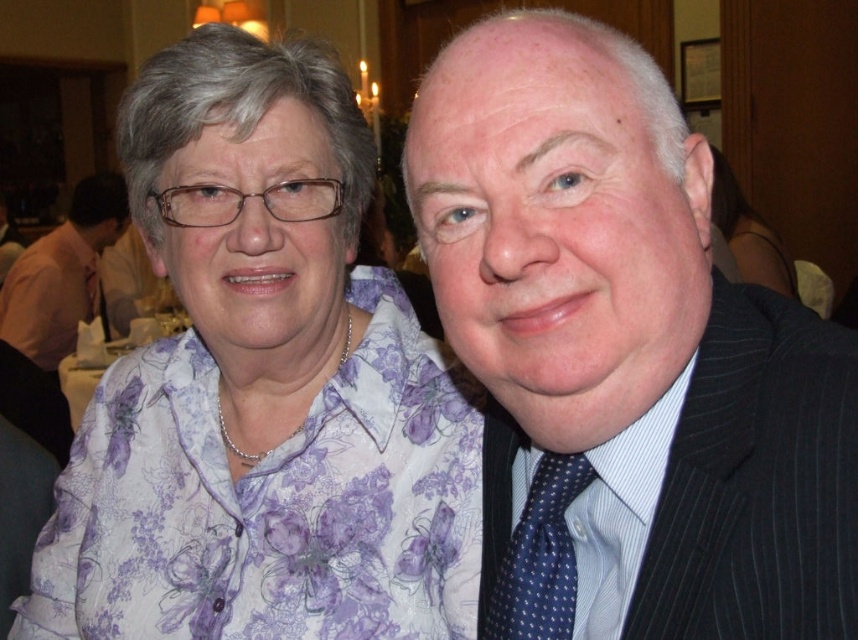
In the scene shown: You are a photographer at a social event and notice two people wearing pinstriped suits. You want to take a photo that includes both of them. If you position your camera to focus on the dark blue pinstripe suit at right, will the pinstriped suit at right also be in the frame?

The pinstriped suit at right is to the left of the dark blue pinstripe suit at right. Since they are positioned next to each other with the pinstriped suit at right being on the left side of the dark blue one, if you focus on the dark blue pinstripe suit at right, the pinstriped suit at right should still be within the camera frame as they are adjacent.